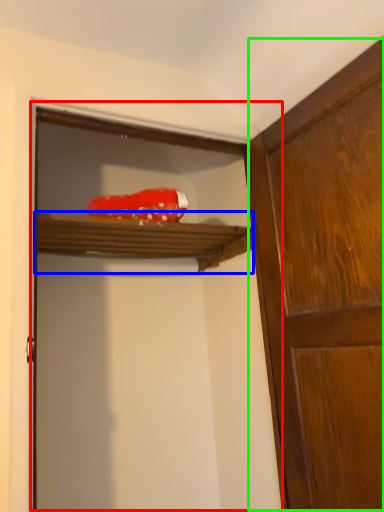
Question: Based on their relative distances, which object is farther from screen door (highlighted by a red box)? Choose from shelf (highlighted by a blue box) and cabinetry (highlighted by a green box).

Choices:
 (A) shelf
 (B) cabinetry

Answer: (B)